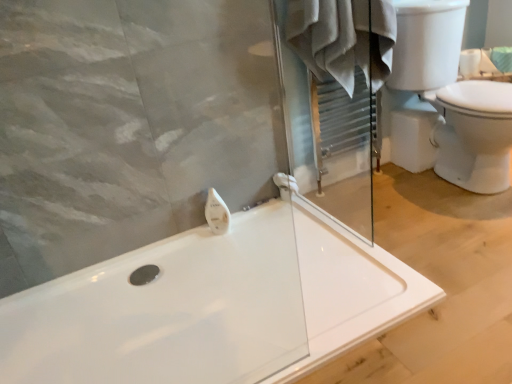
Question: Is white glossy soap dispenser at upper center bigger or smaller than white glossy toilet at right?

Choices:
 (A) big
 (B) small

Answer: (B)

Question: In terms of width, does white glossy soap dispenser at upper center look wider or thinner when compared to white glossy toilet at right?

Choices:
 (A) wide
 (B) thin

Answer: (B)

Question: Estimate the real-world distances between objects in this image. Which object is closer to the white glossy soap dispenser at upper center?

Choices:
 (A) white glossy toilet at right
 (B) white cotton bathrobe at upper center
 (C) white plastic towel bar at center
 (D) white glossy bathtub at center

Answer: (C)

Question: Which object is the closest to the white cotton bathrobe at upper center?

Choices:
 (A) white plastic towel bar at center
 (B) white glossy bathtub at center
 (C) white glossy soap dispenser at upper center
 (D) white glossy toilet at right

Answer: (D)